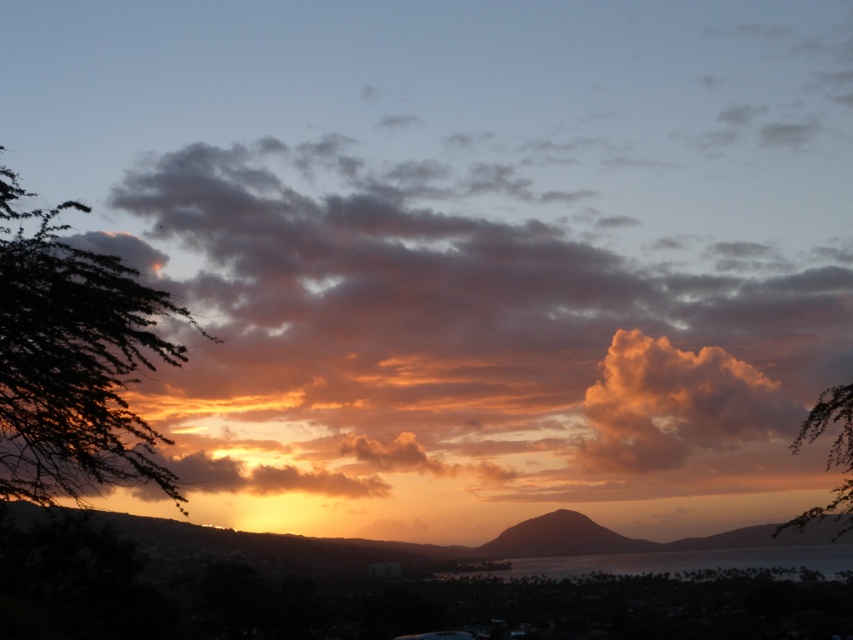
Can you confirm if silky black branches at left is positioned below orange cotton cloud at upper right?

Incorrect, silky black branches at left is not positioned below orange cotton cloud at upper right.

Is silky black branches at left above orange cotton cloud at upper right?

Yes, silky black branches at left is above orange cotton cloud at upper right.

Which is behind, point (57, 234) or point (753, 416)?

Point (753, 416)

Where is `silky black branches at left`? silky black branches at left is located at coordinates (73, 360).

Between translucent glass water at lower center and matte orange cloud at upper left, which one appears on the left side from the viewer's perspective?

matte orange cloud at upper left is more to the left.

Which is in front, point (674, 570) or point (73, 241)?

Point (73, 241) is more forward.

Measure the distance between point (x=796, y=554) and camera.

A distance of 247.71 feet exists between point (x=796, y=554) and camera.

The height and width of the screenshot is (640, 853). I want to click on translucent glass water at lower center, so click(679, 561).

Between silky black branches at left and green leafy branch at right, which one has more height?

Standing taller between the two is silky black branches at left.

Does point (109, 408) come closer to viewer compared to point (811, 433)?

That is True.

Locate an element on the screen. The width and height of the screenshot is (853, 640). silky black branches at left is located at coordinates (73, 360).